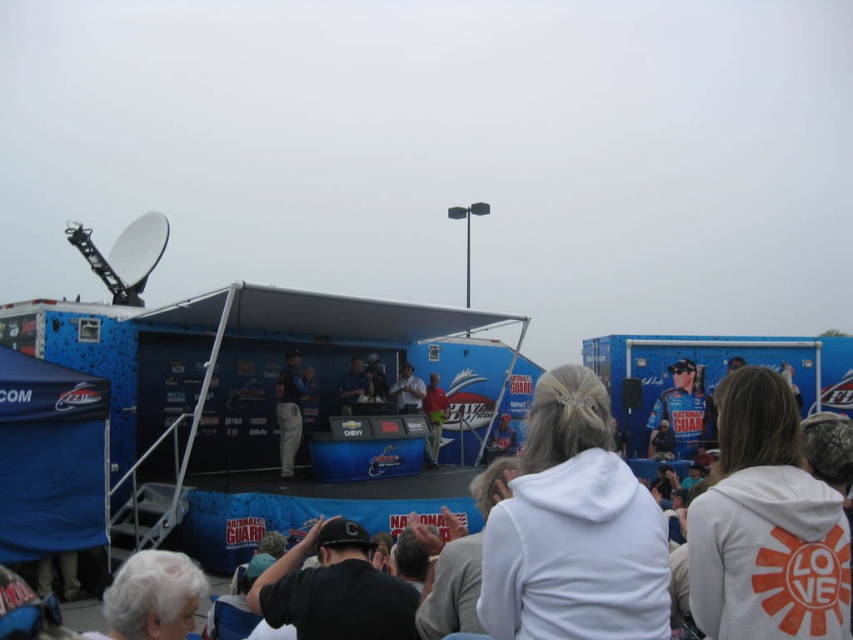
Which is above, white fleece jacket at lower right or matte red shirt at center?

white fleece jacket at lower right

Between point (752, 621) and point (440, 396), which one is positioned in front?

Point (752, 621) is more forward.

The width and height of the screenshot is (853, 640). Find the location of `white fleece jacket at lower right`. white fleece jacket at lower right is located at coordinates [766, 525].

Between light gray fabric jacket at center and matte red shirt at center, which one has more height?

With more height is light gray fabric jacket at center.

Between point (291, 400) and point (444, 404), which one is positioned in front?

Point (291, 400)

Is point (303, 371) closer to viewer compared to point (425, 392)?

Yes, point (303, 371) is in front of point (425, 392).

Image resolution: width=853 pixels, height=640 pixels. In order to click on light gray fabric jacket at center in this screenshot , I will do `click(289, 410)`.

Who is more distant from viewer, (704, 630) or (428, 394)?

Positioned behind is point (428, 394).

Which is in front, point (714, 516) or point (439, 442)?

Positioned in front is point (714, 516).

The image size is (853, 640). What are the coordinates of `white fleece sweatshirt at center` in the screenshot? It's located at (756, 424).